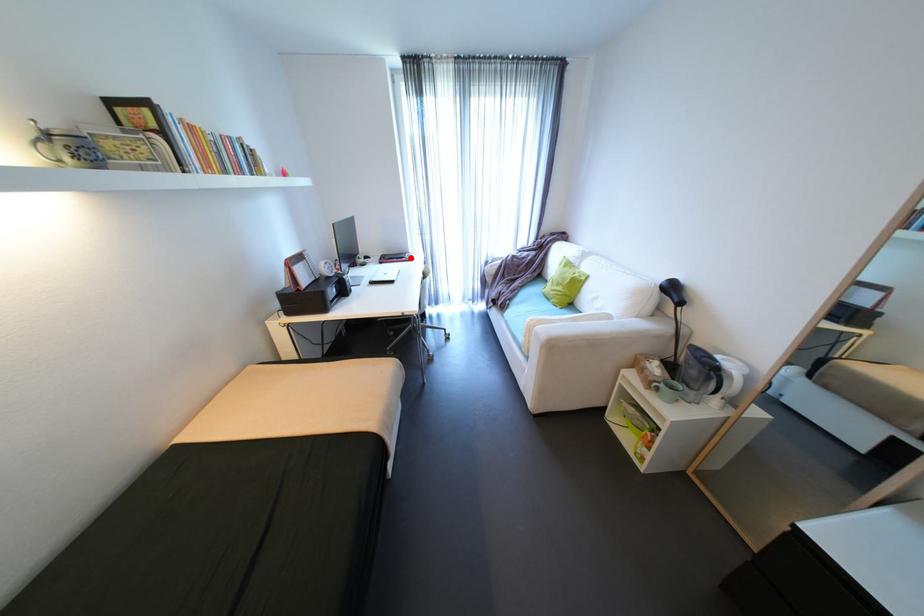
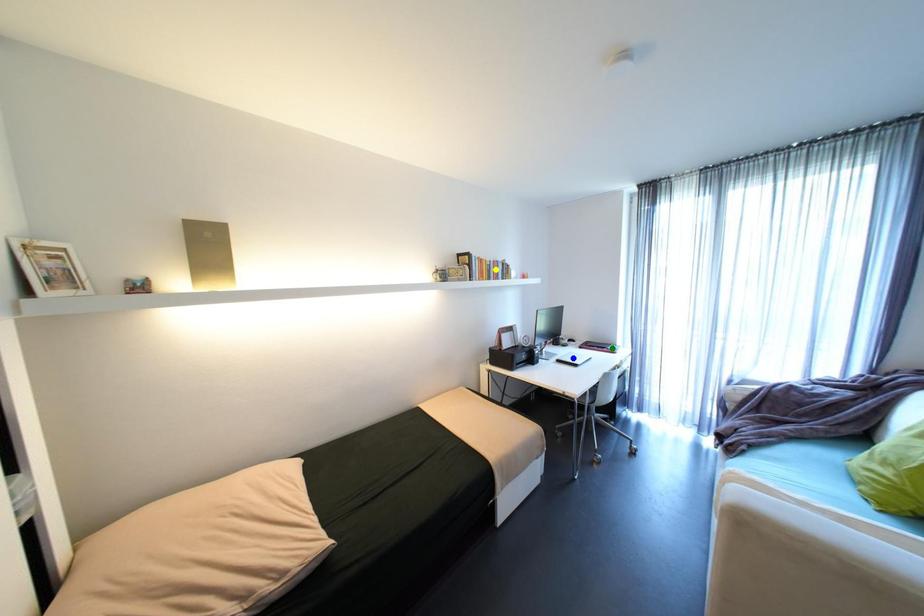
Question: I am providing you with two images of the same scene from different viewpoints. A red point is marked on the first image. You are given multiple points on the second image. Which point in image 2 represents the same 3d spot as the red point in image 1?

Choices:
 (A) blue point
 (B) green point
 (C) yellow point

Answer: (B)